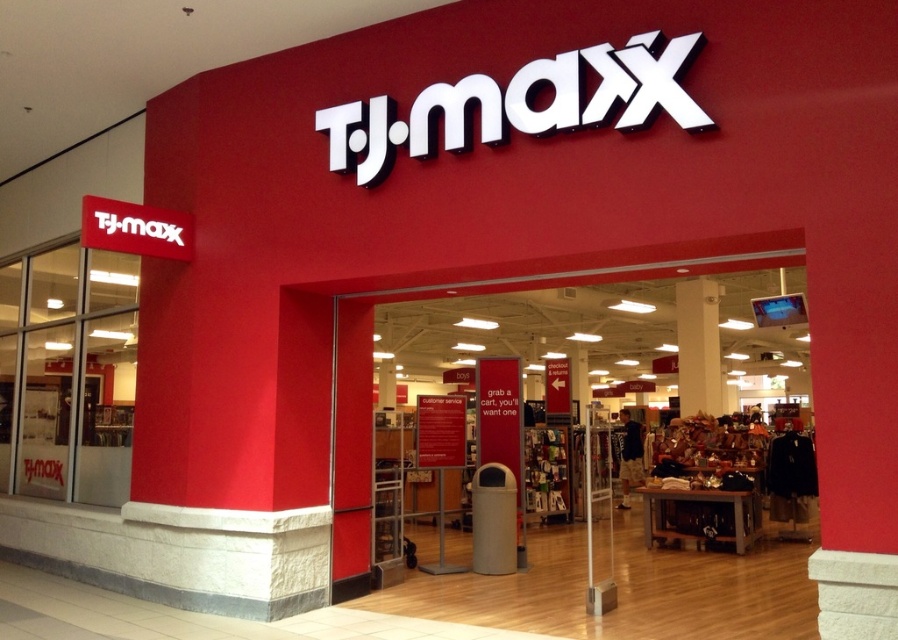
Question: Which of the following is the farthest from the observer?

Choices:
 (A) white glossy pillar at upper center
 (B) wooden table at center

Answer: (A)

Question: Can you confirm if wooden table at center is thinner than white glossy pillar at upper center?

Choices:
 (A) yes
 (B) no

Answer: (B)

Question: Can you confirm if wooden table at center is bigger than white glossy pillar at upper center?

Choices:
 (A) yes
 (B) no

Answer: (A)

Question: Which of the following is the closest to the observer?

Choices:
 (A) white glossy pillar at upper center
 (B) wooden table at center

Answer: (B)

Question: Can you confirm if wooden table at center is positioned to the left of white glossy pillar at upper center?

Choices:
 (A) yes
 (B) no

Answer: (A)